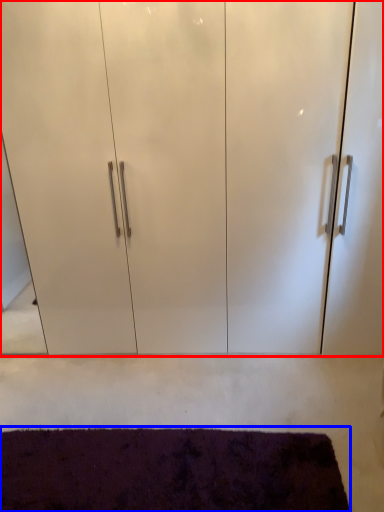
Question: Which point is closer to the camera, cupboard (highlighted by a red box) or mat (highlighted by a blue box)?

Choices:
 (A) cupboard
 (B) mat

Answer: (B)